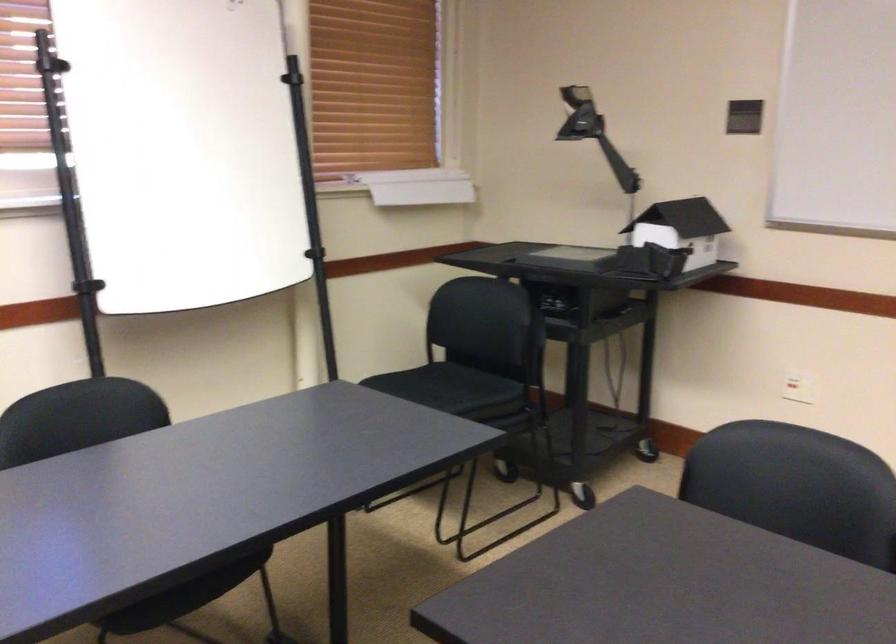
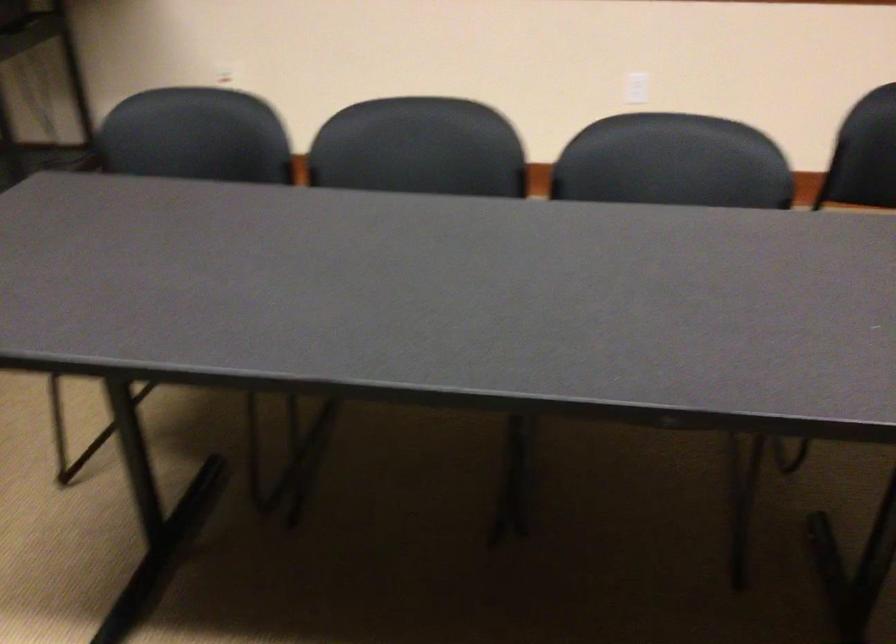
The images are taken continuously from a first-person perspective. In which direction is your viewpoint rotating?

The camera's rotation is toward right-down.